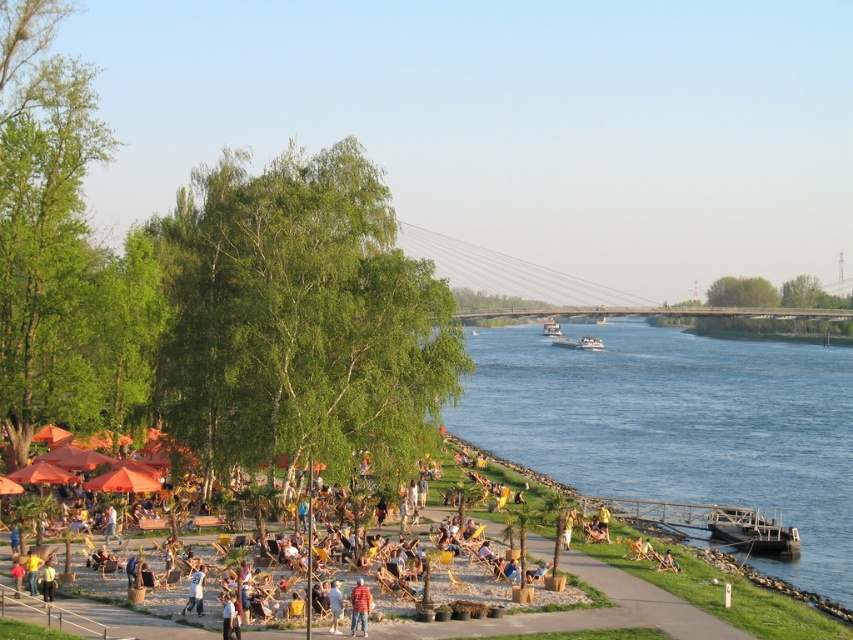
Question: Which of the following is the farthest from the observer?

Choices:
 (A) (366, 634)
 (B) (610, 380)
 (C) (334, 614)

Answer: (B)

Question: Does blue water at center have a lesser width compared to striped shirt at lower center?

Choices:
 (A) no
 (B) yes

Answer: (A)

Question: Can you confirm if blue water at center is thinner than striped shirt at lower center?

Choices:
 (A) no
 (B) yes

Answer: (A)

Question: Does blue water at center appear on the left side of striped shirt at lower center?

Choices:
 (A) yes
 (B) no

Answer: (B)

Question: Which point is closer to the camera taking this photo?

Choices:
 (A) (531, 451)
 (B) (334, 612)
 (C) (357, 600)

Answer: (C)

Question: Based on their relative distances, which object is farther from the blue water at center?

Choices:
 (A) white cotton shirt at center
 (B) striped shirt at lower center

Answer: (B)